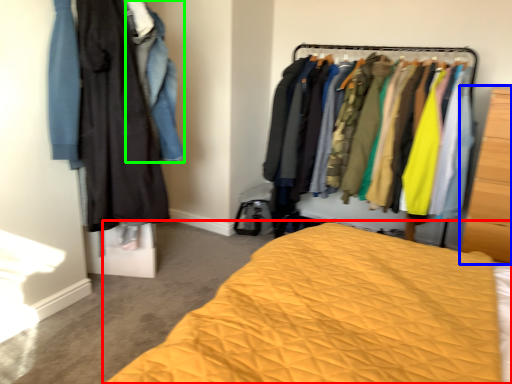
Question: Considering the real-world distances, which object is closest to bed (highlighted by a red box)? furniture (highlighted by a blue box) or clothing (highlighted by a green box).

Choices:
 (A) furniture
 (B) clothing

Answer: (B)